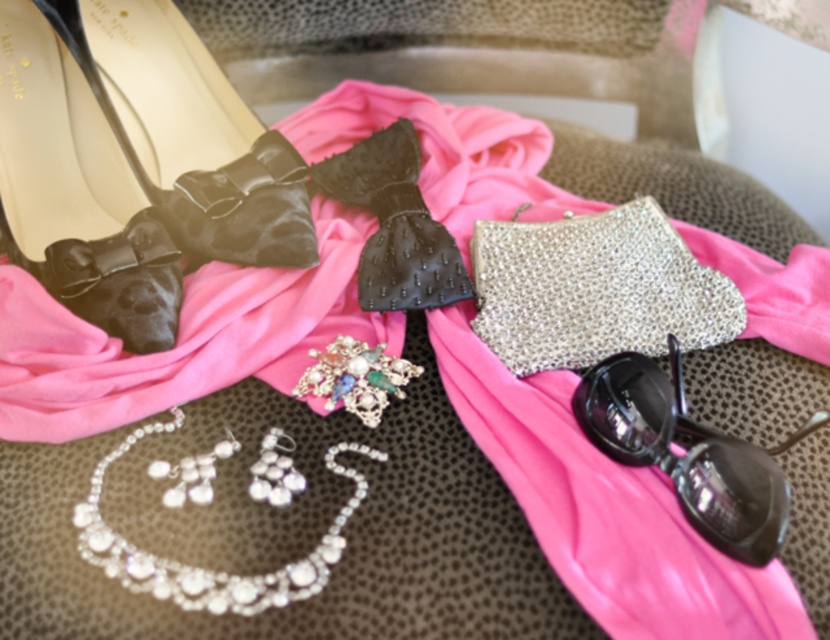
You are organizing a display of accessories and need to place the matte black bow at upper left and the pearl and gemstone brooch at center. According to the arrangement shown, which accessory is positioned to the right of the other?

The pearl and gemstone brooch at center is positioned to the right of the matte black bow at upper left.

You are a fashion designer organizing accessories on a table. You have the black plastic goggles at lower right and the pearl and gemstone brooch at center. You want to place a decorative ribbon between them. How far apart should you position the ribbon from each accessory to maintain equal distance?

To maintain equal distance between the black plastic goggles at lower right and the pearl and gemstone brooch at center, the decorative ribbon should be placed 7.305 inches away from each accessory. This is half of the 14.61 inches distance between them.